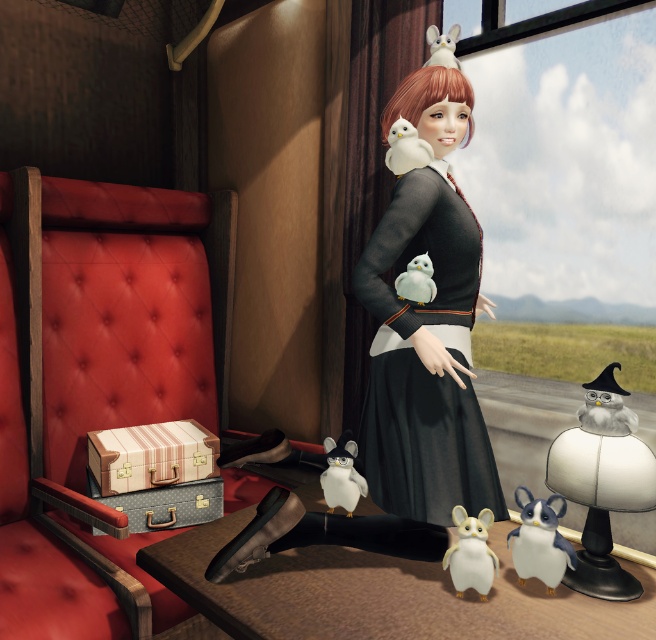
You are a fashion designer observing the train compartment scene. You notice the black matte dress at center and the plush gray owl at center. Which item would require more fabric to create, based on their sizes?

The black matte dress at center has a larger size compared to the plush gray owl at center, so it would require more fabric to create.